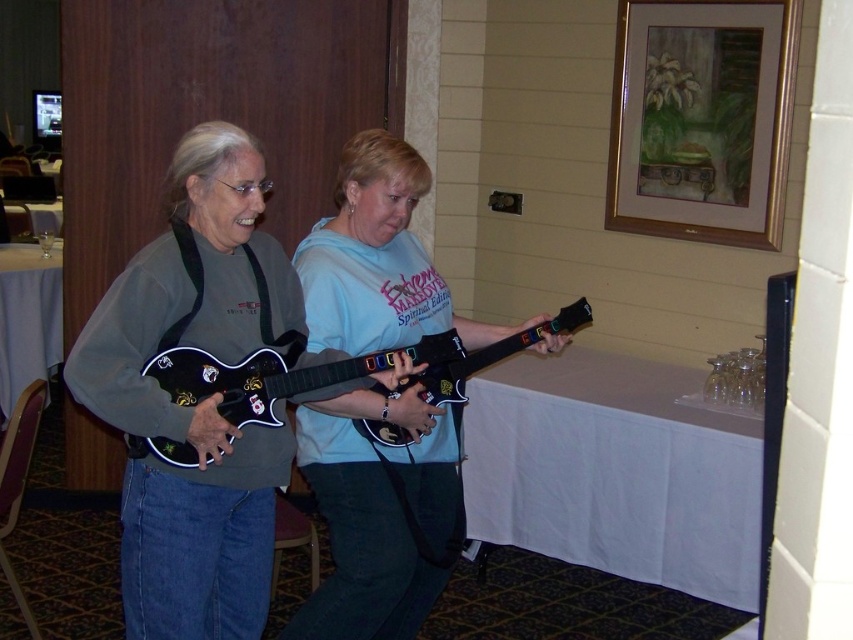
In order to click on light blue fabric guitar at center in this screenshot , I will do `click(380, 513)`.

Is point (308, 316) in front of point (170, 356)?

No, it is not.

Locate an element on the screen. This screenshot has height=640, width=853. light blue fabric guitar at center is located at coordinates (380, 513).

Is black glossy electric guitar at center taller than glossy plastic guitar at center?

In fact, black glossy electric guitar at center may be shorter than glossy plastic guitar at center.

Between black glossy electric guitar at center and glossy plastic guitar at center, which one has more height?

glossy plastic guitar at center is taller.

Where is `black glossy electric guitar at center`? The width and height of the screenshot is (853, 640). black glossy electric guitar at center is located at coordinates (251, 378).

Does light blue fabric guitar at center have a smaller size compared to glossy plastic guitar at center?

Actually, light blue fabric guitar at center might be larger than glossy plastic guitar at center.

Looking at this image, does light blue fabric guitar at center appear over glossy plastic guitar at center?

Incorrect, light blue fabric guitar at center is not positioned above glossy plastic guitar at center.

You are a GUI agent. You are given a task and a screenshot of the screen. Output one action in this format:
    pyautogui.click(x=<x>, y=<y>)
    Task: Click on the light blue fabric guitar at center
    
    Given the screenshot: What is the action you would take?
    pyautogui.click(x=380, y=513)

At what (x,y) coordinates should I click in order to perform the action: click on light blue fabric guitar at center. Please return your answer as a coordinate pair (x, y). Looking at the image, I should click on tap(380, 513).